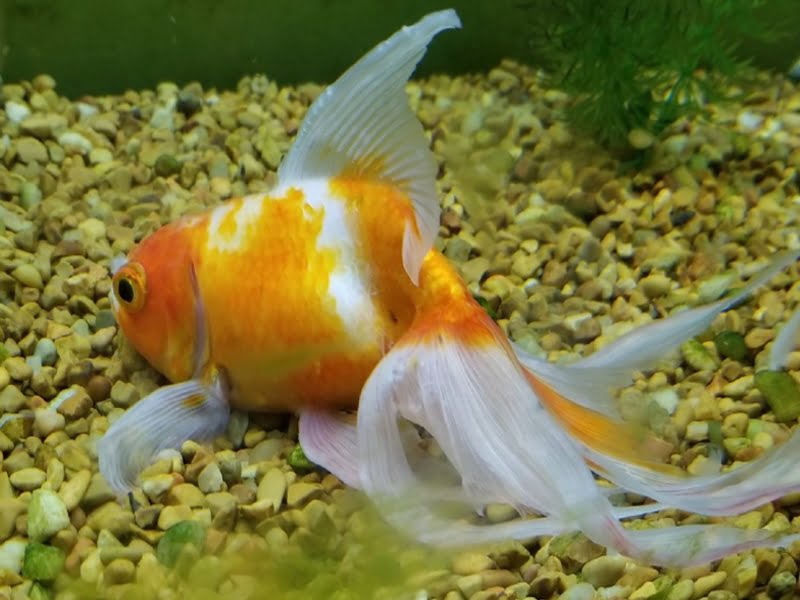
Where is `plant`? plant is located at coordinates (617, 67).